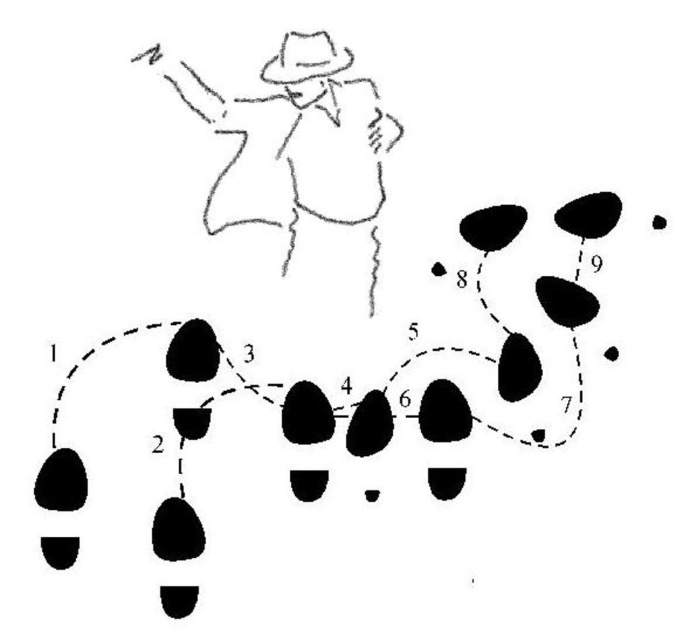
Question: Observing the image, what is the correct spatial positioning of black rubber footprints at lower left in reference to matte black cowboy hat at upper center?

Choices:
 (A) above
 (B) below

Answer: (B)

Question: Is black rubber footprints at lower left further to camera compared to matte black cowboy hat at upper center?

Choices:
 (A) no
 (B) yes

Answer: (A)

Question: Which is farther from the black rubber footprints at lower left?

Choices:
 (A) black line drawing man at upper left
 (B) matte black cowboy hat at upper center

Answer: (B)

Question: Among these points, which one is nearest to the camera?

Choices:
 (A) (284, 164)
 (B) (199, 532)
 (C) (306, 58)

Answer: (B)

Question: Which object is positioned farthest from the black line drawing man at upper left?

Choices:
 (A) black rubber footprints at lower left
 (B) matte black cowboy hat at upper center

Answer: (A)

Question: Is black line drawing man at upper left smaller than matte black cowboy hat at upper center?

Choices:
 (A) no
 (B) yes

Answer: (A)